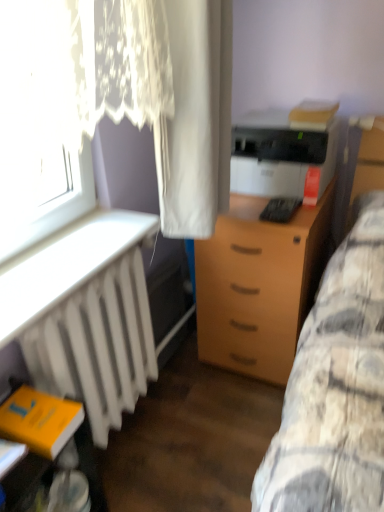
Question: Considering the relative sizes of black plastic keyboard at center and light brown wood drawer at center in the image provided, is black plastic keyboard at center shorter than light brown wood drawer at center?

Choices:
 (A) yes
 (B) no

Answer: (A)

Question: Is light brown wood drawer at center located within black plastic keyboard at center?

Choices:
 (A) no
 (B) yes

Answer: (A)

Question: From the image's perspective, is black plastic keyboard at center above light brown wood drawer at center?

Choices:
 (A) no
 (B) yes

Answer: (B)

Question: Is black plastic keyboard at center not near light brown wood drawer at center?

Choices:
 (A) no
 (B) yes

Answer: (A)

Question: Is black plastic keyboard at center in front of light brown wood drawer at center?

Choices:
 (A) no
 (B) yes

Answer: (A)

Question: Considering their positions, is white fabric curtain at center, marked as the 1th curtain in a right-to-left arrangement, located in front of or behind matte black printer at center right?

Choices:
 (A) behind
 (B) front

Answer: (B)

Question: Do you think white fabric curtain at center, marked as the 1th curtain in a right-to-left arrangement, is within matte black printer at center right, or outside of it?

Choices:
 (A) inside
 (B) outside

Answer: (B)

Question: In terms of size, does white fabric curtain at center, marked as the 1th curtain in a right-to-left arrangement, appear bigger or smaller than matte black printer at center right?

Choices:
 (A) small
 (B) big

Answer: (B)

Question: From the image's perspective, relative to matte black printer at center right, is white fabric curtain at center, marked as the 1th curtain in a right-to-left arrangement, above or below?

Choices:
 (A) below
 (B) above

Answer: (A)

Question: Considering the positions of point (279, 199) and point (273, 282), is point (279, 199) closer or farther from the camera than point (273, 282)?

Choices:
 (A) closer
 (B) farther

Answer: (B)

Question: From the image's perspective, is black plastic keyboard at center positioned above or below light brown wood drawer at center?

Choices:
 (A) below
 (B) above

Answer: (B)

Question: Is black plastic keyboard at center inside or outside of light brown wood drawer at center?

Choices:
 (A) outside
 (B) inside

Answer: (A)

Question: From a real-world perspective, is black plastic keyboard at center physically located above or below light brown wood drawer at center?

Choices:
 (A) above
 (B) below

Answer: (A)

Question: Is white fabric curtain at center, the 2th curtain in the left-to-right sequence, bigger or smaller than yellow matte book at lower left?

Choices:
 (A) small
 (B) big

Answer: (B)

Question: In the image, is white fabric curtain at center, marked as the 1th curtain in a right-to-left arrangement, on the left side or the right side of yellow matte book at lower left?

Choices:
 (A) left
 (B) right

Answer: (B)